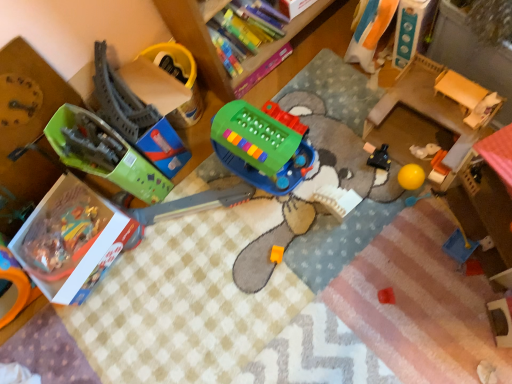
Locate an element on the screen. The width and height of the screenshot is (512, 384). vacant area that is in front of gray plastic train tracks at left, placed as the sixth toy when sorted from right to left is located at coordinates (174, 236).